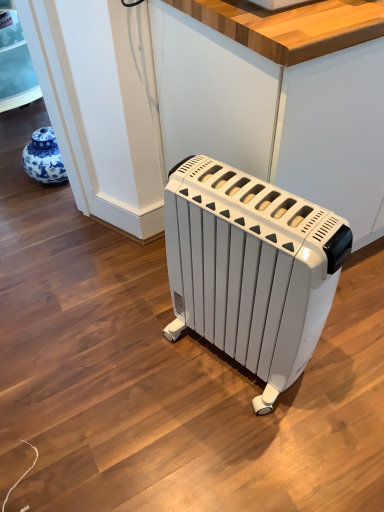
Question: Based on their sizes in the image, would you say wooden at center is bigger or smaller than white plastic radiator at center?

Choices:
 (A) small
 (B) big

Answer: (B)

Question: Based on their positions, is wooden at center located to the left or right of white plastic radiator at center?

Choices:
 (A) right
 (B) left

Answer: (A)

Question: Considering their positions, is wooden at center located in front of or behind white plastic radiator at center?

Choices:
 (A) front
 (B) behind

Answer: (B)

Question: In the image, is white plastic radiator at center positioned in front of or behind wooden at center?

Choices:
 (A) front
 (B) behind

Answer: (A)

Question: Based on their sizes in the image, would you say white plastic radiator at center is bigger or smaller than wooden at center?

Choices:
 (A) big
 (B) small

Answer: (B)

Question: Do you think white plastic radiator at center is within wooden at center, or outside of it?

Choices:
 (A) inside
 (B) outside

Answer: (B)

Question: Based on their positions, is white plastic radiator at center located to the left or right of wooden at center?

Choices:
 (A) left
 (B) right

Answer: (A)